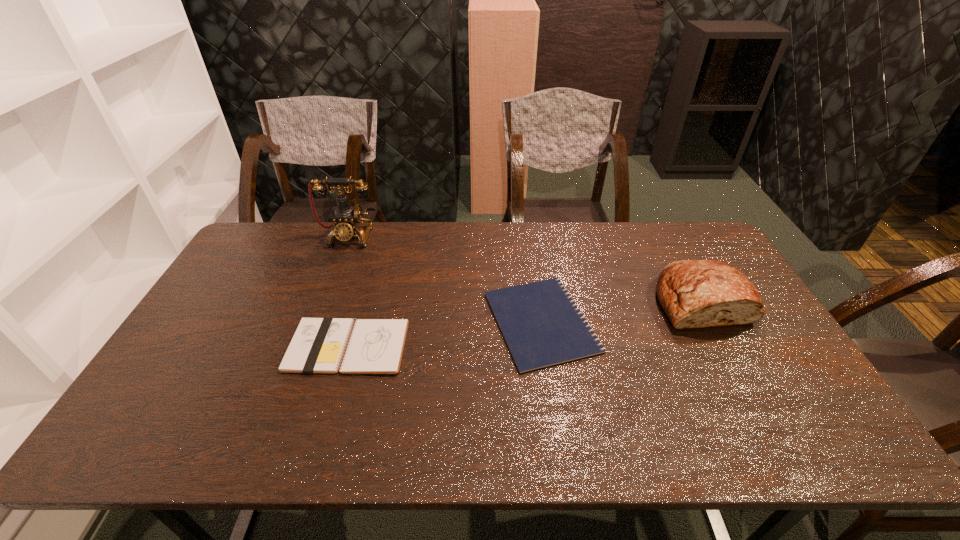
The image size is (960, 540). I want to click on vacant space located 0.090m on the left of the left notepad, so click(x=257, y=346).

Image resolution: width=960 pixels, height=540 pixels. Find the location of `vacant space located on the left of the right notepad`. vacant space located on the left of the right notepad is located at coordinates (430, 322).

You are a GUI agent. You are given a task and a screenshot of the screen. Output one action in this format:
    pyautogui.click(x=<x>, y=<y>)
    Task: Click on the object that is positioned at the far edge
    The height and width of the screenshot is (540, 960).
    Given the screenshot: What is the action you would take?
    pyautogui.click(x=346, y=219)

I want to click on object present at the right edge, so click(693, 293).

Identify the location of free space at the far edge. This screenshot has height=540, width=960. (408, 261).

This screenshot has height=540, width=960. Find the location of `vacant area at the near edge of the desktop`. vacant area at the near edge of the desktop is located at coordinates (351, 455).

You are a GUI agent. You are given a task and a screenshot of the screen. Output one action in this format:
    pyautogui.click(x=<x>, y=<y>)
    Task: Click on the vacant region at the right edge of the desktop
    Image resolution: width=960 pixels, height=540 pixels.
    Given the screenshot: What is the action you would take?
    pyautogui.click(x=732, y=343)

Locate an element on the screen. The height and width of the screenshot is (540, 960). vacant position at the far left corner of the desktop is located at coordinates (256, 231).

Where is `vacant area between the tallest object and the second tallest object`? This screenshot has height=540, width=960. vacant area between the tallest object and the second tallest object is located at coordinates (525, 269).

Locate an element on the screen. This screenshot has height=540, width=960. unoccupied position between the left notepad and the telephone is located at coordinates (348, 292).